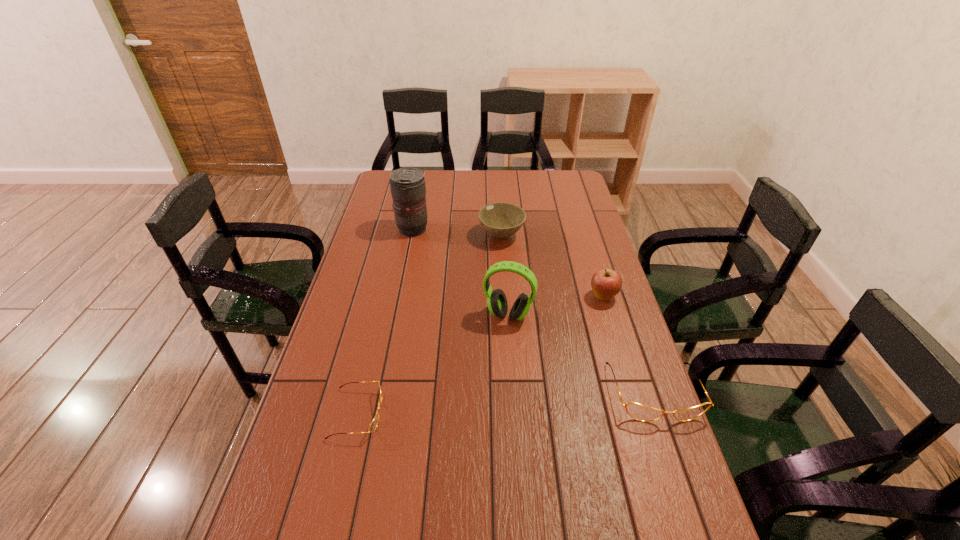
Locate an element on the screen. This screenshot has height=540, width=960. the left spectacles is located at coordinates (373, 425).

Locate an element on the screen. the shorter spectacles is located at coordinates (373, 425).

This screenshot has height=540, width=960. In order to click on the fifth tallest object in this screenshot , I will do `click(637, 411)`.

This screenshot has height=540, width=960. Identify the location of the right spectacles. point(637,411).

The height and width of the screenshot is (540, 960). Find the location of `the tallest object`. the tallest object is located at coordinates (408, 189).

The height and width of the screenshot is (540, 960). Identify the location of apple. (606, 283).

Where is `bowl`? bowl is located at coordinates (501, 220).

Identify the location of the fifth shortest object. (497, 303).

Image resolution: width=960 pixels, height=540 pixels. In order to click on vacant area situated 0.360m on the front-facing side of the left spectacles in this screenshot , I will do click(x=522, y=413).

Identify the location of vacant space located 0.190m on the front-facing side of the fifth tallest object. The width and height of the screenshot is (960, 540). (692, 503).